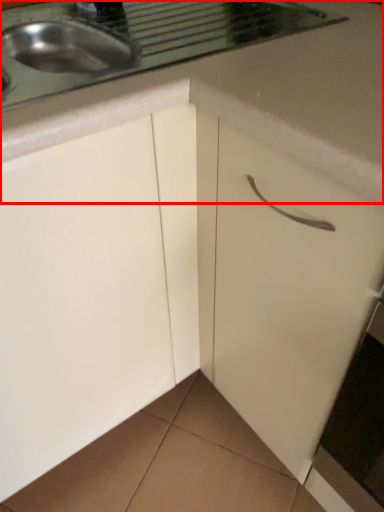
Question: From the image's perspective, what is the correct spatial relationship of countertop (annotated by the red box) in relation to drawer?

Choices:
 (A) below
 (B) above

Answer: (B)